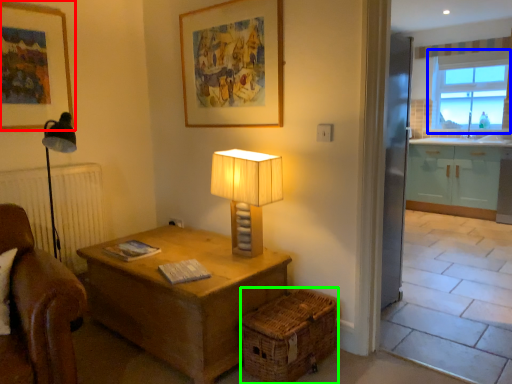
Question: Which object is positioned farthest from picture frame (highlighted by a red box)? Select from window (highlighted by a blue box) and crate (highlighted by a green box).

Choices:
 (A) window
 (B) crate

Answer: (A)